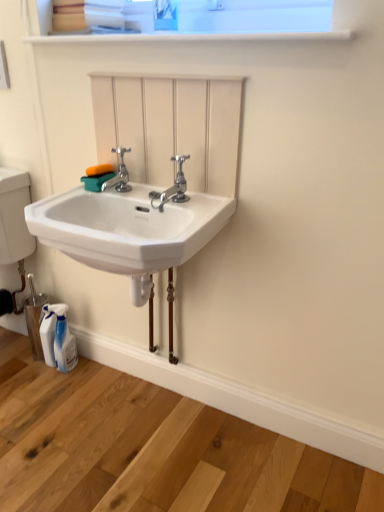
Where is `free space to the left of white glossy spray bottle at lower left`? The height and width of the screenshot is (512, 384). free space to the left of white glossy spray bottle at lower left is located at coordinates (22, 372).